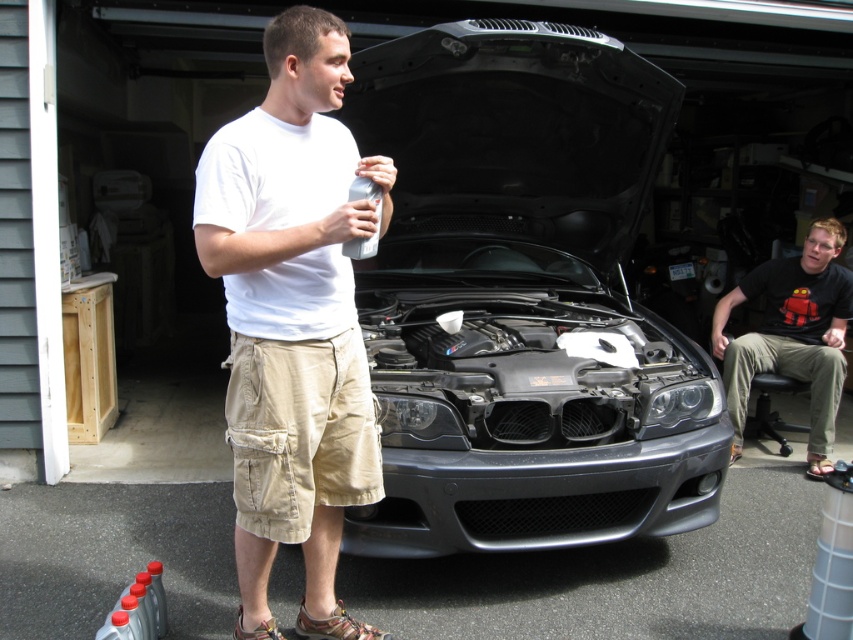
Question: From the image, what is the correct spatial relationship of satin black car at center in relation to black cotton shirt at right?

Choices:
 (A) below
 (B) above

Answer: (B)

Question: Among these points, which one is nearest to the camera?

Choices:
 (A) (795, 307)
 (B) (328, 362)
 (C) (556, 237)

Answer: (B)

Question: Which object is positioned farthest from the black cotton shirt at right?

Choices:
 (A) satin black car at center
 (B) white cotton t-shirt at center

Answer: (B)

Question: Estimate the real-world distances between objects in this image. Which object is farther from the white cotton t-shirt at center?

Choices:
 (A) satin black car at center
 (B) black cotton shirt at right

Answer: (B)

Question: Does white cotton t-shirt at center have a larger size compared to black cotton shirt at right?

Choices:
 (A) yes
 (B) no

Answer: (B)

Question: Considering the relative positions of satin black car at center and black cotton shirt at right in the image provided, where is satin black car at center located with respect to black cotton shirt at right?

Choices:
 (A) above
 (B) below

Answer: (A)